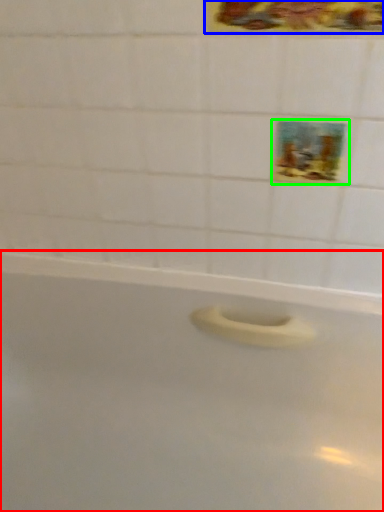
Question: Based on their relative distances, which object is farther from bathtub (highlighted by a red box)? Choose from decorative picture (highlighted by a blue box) and decorative picture (highlighted by a green box).

Choices:
 (A) decorative picture
 (B) decorative picture

Answer: (A)